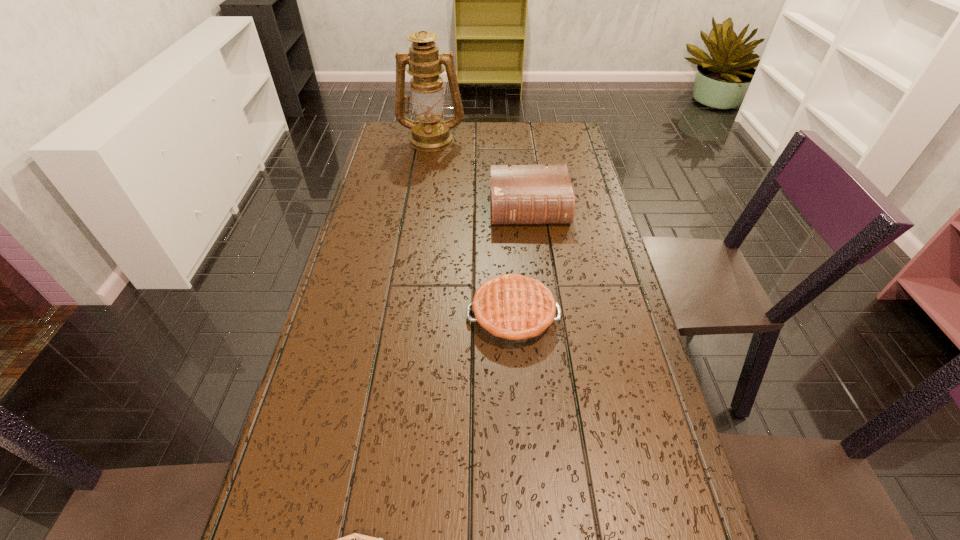
The image size is (960, 540). Identify the location of oil lamp. (430, 133).

Where is `the farthest object`? The height and width of the screenshot is (540, 960). the farthest object is located at coordinates (430, 133).

The width and height of the screenshot is (960, 540). I want to click on the third shortest object, so click(520, 194).

The height and width of the screenshot is (540, 960). In order to click on Bible in this screenshot , I will do `click(520, 194)`.

Identify the location of the second shortest object. (514, 309).

The image size is (960, 540). Identify the location of pie. (514, 309).

This screenshot has height=540, width=960. What are the coordinates of `free region located 0.110m on the right of the farthest object` in the screenshot? It's located at (493, 139).

Find the location of a particular element. The width and height of the screenshot is (960, 540). free space located 0.160m on the spine side of the Bible is located at coordinates (537, 267).

Where is `free location located on the left of the second nearest object`? free location located on the left of the second nearest object is located at coordinates (421, 316).

Find the location of a particular element. The width and height of the screenshot is (960, 540). object that is at the far edge is located at coordinates (430, 133).